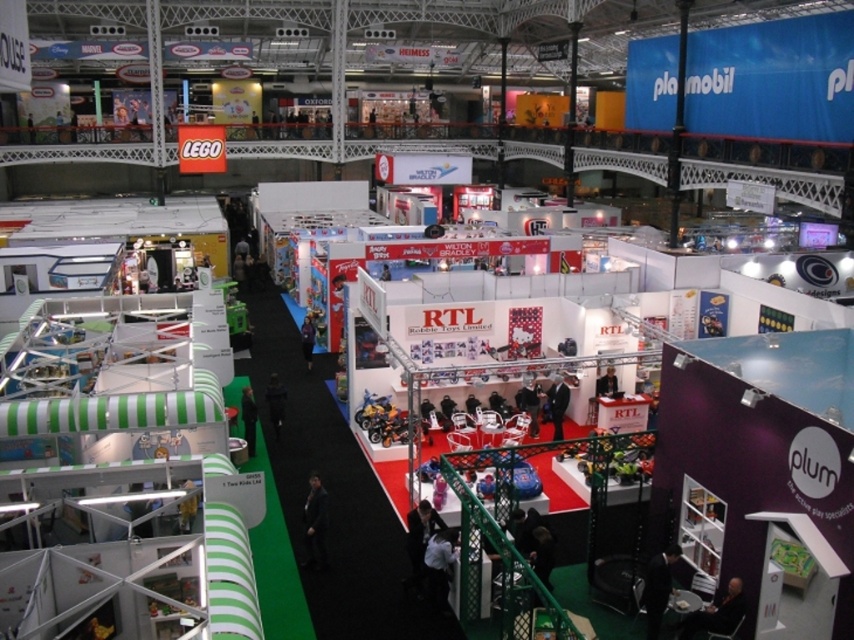
Does black matte jacket at center appear over black leather jacket at center?

No, black matte jacket at center is not above black leather jacket at center.

Where is `black matte jacket at center`? black matte jacket at center is located at coordinates 314,522.

How much distance is there between black matte jacket at center and black suit at center?

They are 8.50 meters apart.

Can you confirm if black matte jacket at center is positioned to the right of black suit at center?

No, black matte jacket at center is not to the right of black suit at center.

At what (x,y) coordinates should I click in order to perform the action: click on black matte jacket at center. Please return your answer as a coordinate pair (x, y). The width and height of the screenshot is (854, 640). Looking at the image, I should click on (314, 522).

Can you confirm if black leather jacket at lower right is positioned to the right of dark green fabric at center?

Indeed, black leather jacket at lower right is positioned on the right side of dark green fabric at center.

Between black leather jacket at lower right and dark green fabric at center, which one appears on the left side from the viewer's perspective?

Positioned to the left is dark green fabric at center.

Who is more forward, (x=646, y=620) or (x=249, y=388)?

Positioned in front is point (x=646, y=620).

Locate an element on the screen. This screenshot has width=854, height=640. black leather jacket at lower right is located at coordinates (658, 588).